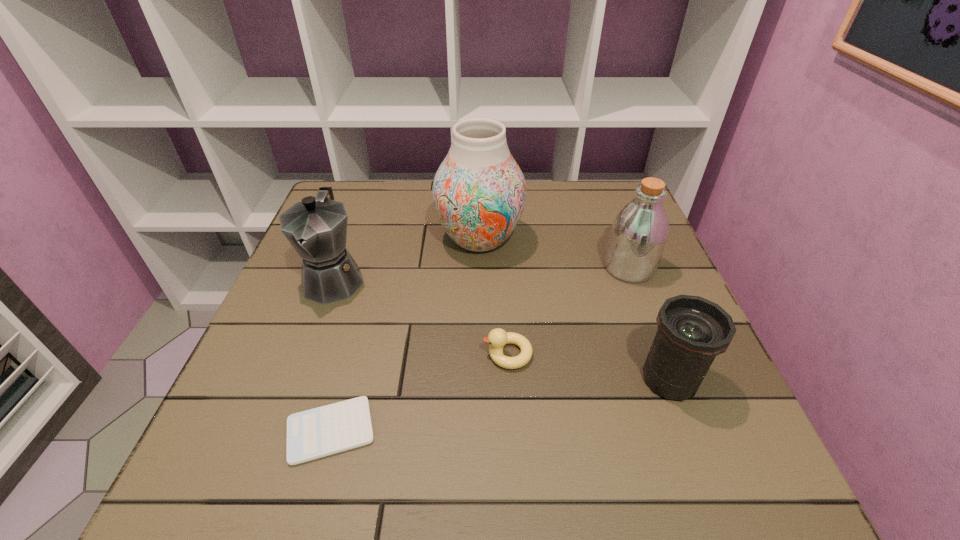
Find the location of a particular element. This screenshot has height=540, width=960. blank region between the duckling and the shortest object is located at coordinates (419, 392).

This screenshot has width=960, height=540. What are the coordinates of `free space between the fifth tallest object and the bottle` in the screenshot? It's located at (568, 311).

This screenshot has width=960, height=540. What are the coordinates of `blank region between the tallest object and the coffeepot` in the screenshot? It's located at (407, 259).

The height and width of the screenshot is (540, 960). I want to click on free space between the fifth tallest object and the bottle, so click(x=568, y=311).

Locate an element on the screen. The height and width of the screenshot is (540, 960). free space between the calculator and the coffeepot is located at coordinates (332, 355).

Image resolution: width=960 pixels, height=540 pixels. What are the coordinates of `vacant space in between the fourth tallest object and the vase` in the screenshot? It's located at (574, 309).

You are a GUI agent. You are given a task and a screenshot of the screen. Output one action in this format:
    pyautogui.click(x=<x>, y=<y>)
    Task: Click on the blank region between the bottle and the fourth tallest object
    The width and height of the screenshot is (960, 540).
    Given the screenshot: What is the action you would take?
    pyautogui.click(x=649, y=324)

Point out which object is positioned as the second nearest to the third shortest object. Please provide its 2D coordinates. Your answer should be formatted as a tuple, i.e. [(x, y)], where the tuple contains the x and y coordinates of a point satisfying the conditions above.

[(639, 233)]

Identify which object is the nearest to the calculator. Please provide its 2D coordinates. Your answer should be formatted as a tuple, i.e. [(x, y)], where the tuple contains the x and y coordinates of a point satisfying the conditions above.

[(497, 338)]

Where is `vacant area that satisfies the following two spatial constraints: 1. at the beak of the telephoto lens; 2. on the right side of the duckling`? The height and width of the screenshot is (540, 960). vacant area that satisfies the following two spatial constraints: 1. at the beak of the telephoto lens; 2. on the right side of the duckling is located at coordinates (509, 380).